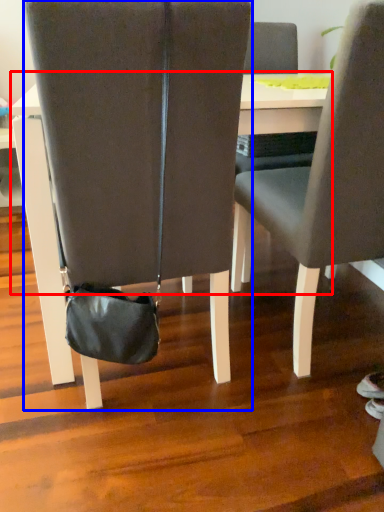
Question: Which object is closer to the camera taking this photo, table (highlighted by a red box) or chair (highlighted by a blue box)?

Choices:
 (A) table
 (B) chair

Answer: (B)